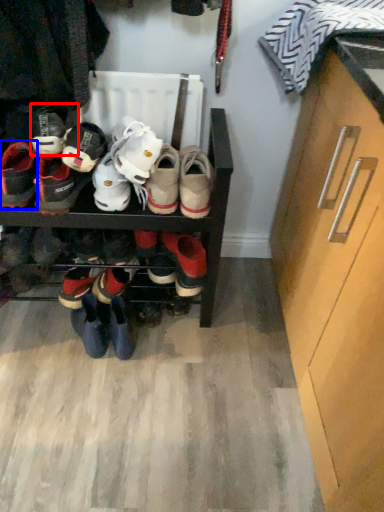
Question: Which of the following is the closest to the observer, footwear (highlighted by a red box) or footwear (highlighted by a blue box)?

Choices:
 (A) footwear
 (B) footwear

Answer: (A)